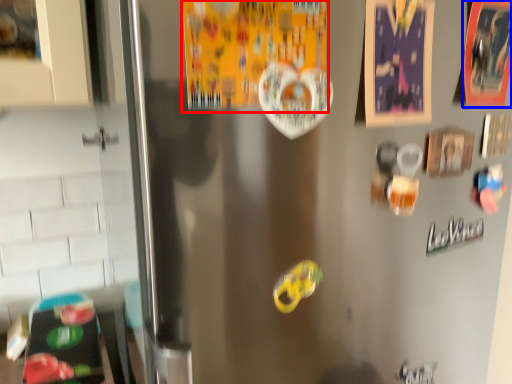
Question: Which object appears farthest to the camera in this image, postcard (highlighted by a red box) or postcard (highlighted by a blue box)?

Choices:
 (A) postcard
 (B) postcard

Answer: (B)